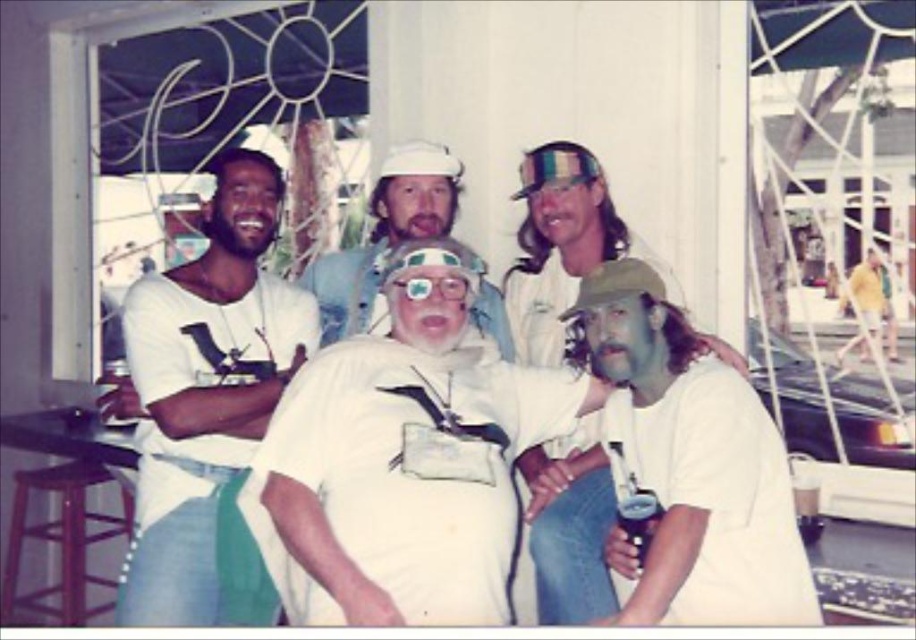
Question: Based on their relative distances, which object is farther from the white matte hat at center?

Choices:
 (A) white matte shirt at center
 (B) white cotton shirt at left
 (C) clear plastic goggles at center

Answer: (C)

Question: Which is farther from the white cotton shirt at left?

Choices:
 (A) wooden stool at lower left
 (B) white matte shirt at center

Answer: (A)

Question: Is white matte shirt at center positioned behind clear plastic goggles at center?

Choices:
 (A) no
 (B) yes

Answer: (B)

Question: Does white matte hat at center have a smaller size compared to wooden stool at lower left?

Choices:
 (A) yes
 (B) no

Answer: (A)

Question: Which object is closer to the camera taking this photo?

Choices:
 (A) white matte shirt at center
 (B) wooden stool at lower left
 (C) white cotton shirt at left

Answer: (A)

Question: Is white cotton shirt at left above clear plastic goggles at center?

Choices:
 (A) yes
 (B) no

Answer: (B)